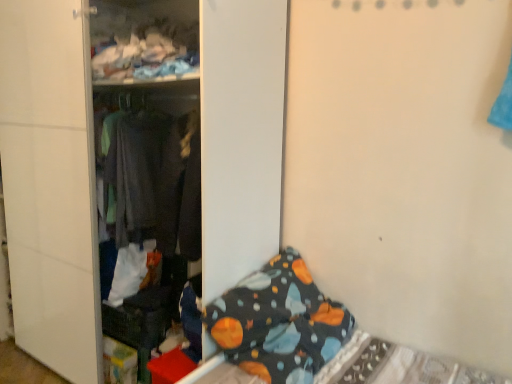
Question: From a real-world perspective, is dark gray fabric at center under dark blue fabric blanket at lower right?

Choices:
 (A) yes
 (B) no

Answer: (B)

Question: From the image's perspective, would you say dark gray fabric at center is positioned over dark blue fabric blanket at lower right?

Choices:
 (A) no
 (B) yes

Answer: (B)

Question: Is dark gray fabric at center surrounding dark blue fabric blanket at lower right?

Choices:
 (A) yes
 (B) no

Answer: (B)

Question: Is dark gray fabric at center completely or partially outside of dark blue fabric blanket at lower right?

Choices:
 (A) no
 (B) yes

Answer: (A)

Question: Is dark gray fabric at center positioned in front of dark blue fabric blanket at lower right?

Choices:
 (A) no
 (B) yes

Answer: (A)

Question: From the image's perspective, is dark gray fabric at center positioned above or below dark blue fabric blanket at lower right?

Choices:
 (A) below
 (B) above

Answer: (B)

Question: From a real-world perspective, is dark gray fabric at center physically located above or below dark blue fabric blanket at lower right?

Choices:
 (A) below
 (B) above

Answer: (B)

Question: Based on their positions, is dark gray fabric at center located to the left or right of dark blue fabric blanket at lower right?

Choices:
 (A) left
 (B) right

Answer: (B)

Question: In terms of size, does dark gray fabric at center appear bigger or smaller than dark blue fabric blanket at lower right?

Choices:
 (A) big
 (B) small

Answer: (B)

Question: Would you say dark blue fabric bed at lower right is inside or outside dark gray fabric at center?

Choices:
 (A) outside
 (B) inside

Answer: (A)

Question: Does point (315, 342) appear closer or farther from the camera than point (145, 221)?

Choices:
 (A) closer
 (B) farther

Answer: (A)

Question: Is dark blue fabric bed at lower right in front of or behind dark gray fabric at center in the image?

Choices:
 (A) behind
 (B) front

Answer: (B)

Question: Would you say dark blue fabric bed at lower right is to the left or to the right of dark gray fabric at center in the picture?

Choices:
 (A) right
 (B) left

Answer: (A)

Question: Is dark gray fabric at center taller or shorter than dark blue fabric pillow at lower right?

Choices:
 (A) tall
 (B) short

Answer: (B)

Question: Is point (145, 216) closer or farther from the camera than point (242, 327)?

Choices:
 (A) farther
 (B) closer

Answer: (A)